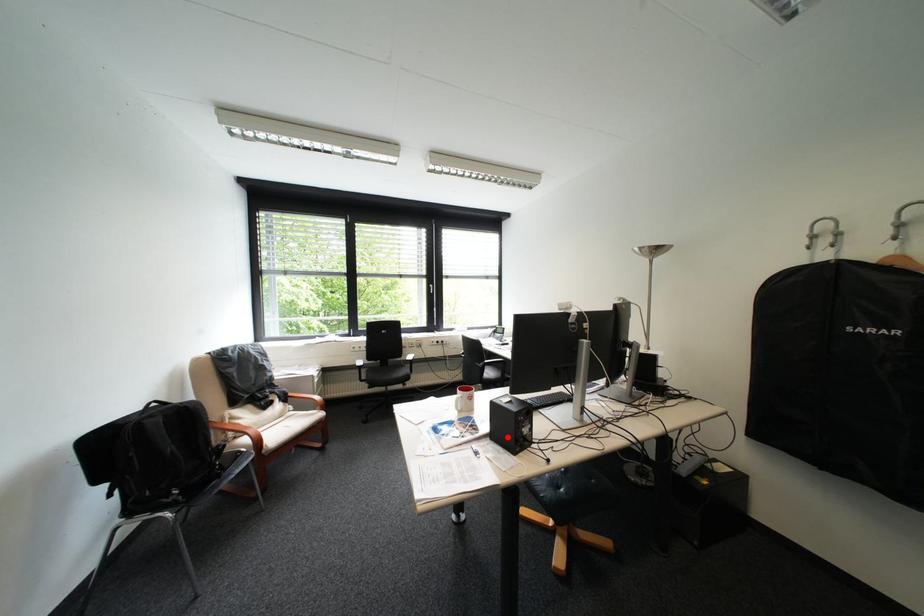
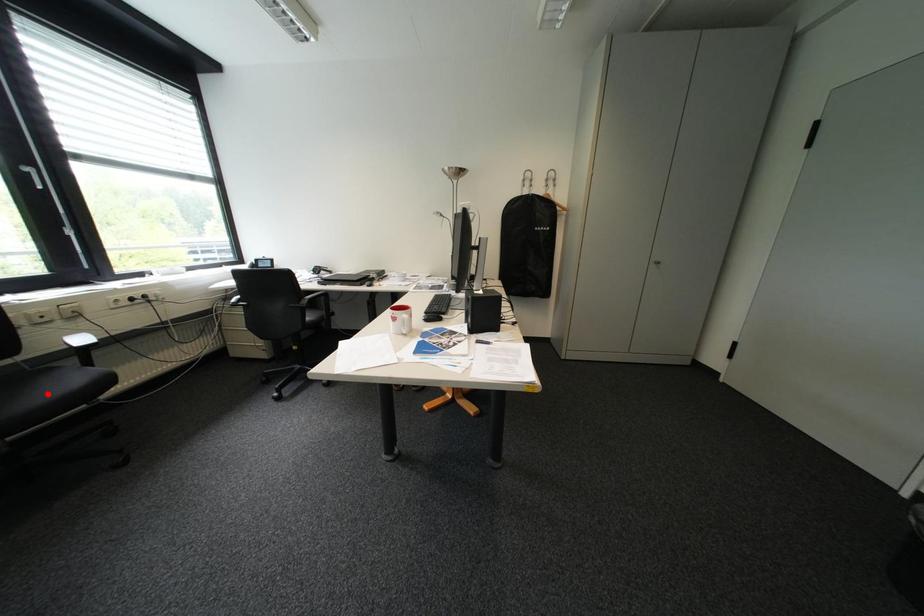
I am providing you with two images of the same scene from different viewpoints. A red point is marked on the first image and another point is marked on the second image. Is the marked point in image1 the same physical position as the marked point in image2?

No